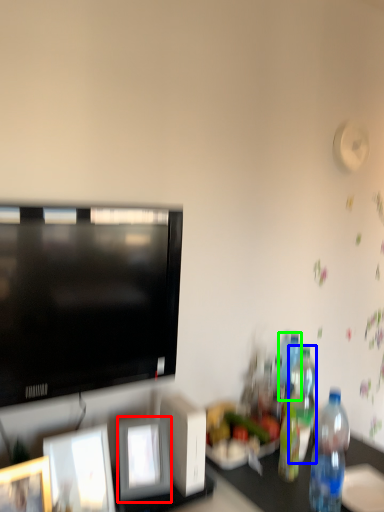
Question: Considering the real-world distances, which object is closest to picture frame (highlighted by a red box)? bottle (highlighted by a blue box) or bottle (highlighted by a green box).

Choices:
 (A) bottle
 (B) bottle

Answer: (A)